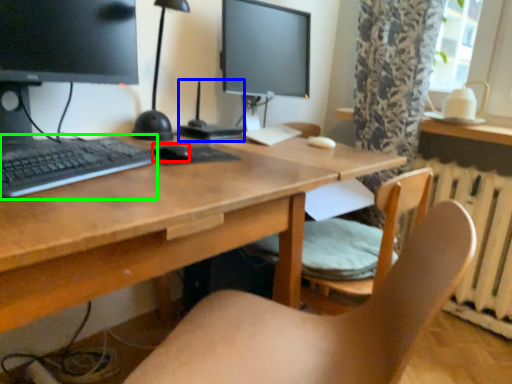
Question: Based on their relative distances, which object is farther from mouse (highlighted by a red box)? Choose from computer (highlighted by a blue box) and computer keyboard (highlighted by a green box).

Choices:
 (A) computer
 (B) computer keyboard

Answer: (A)